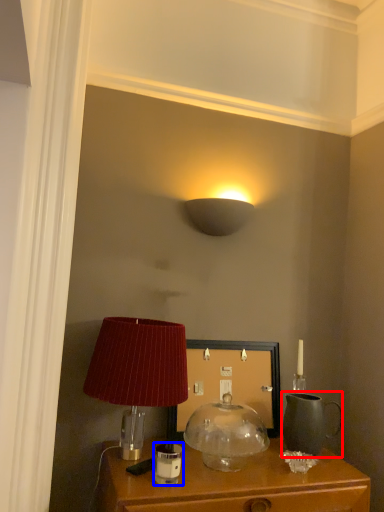
Question: Which point is further to the camera, tea pot (highlighted by a red box) or candle holder (highlighted by a blue box)?

Choices:
 (A) tea pot
 (B) candle holder

Answer: (A)